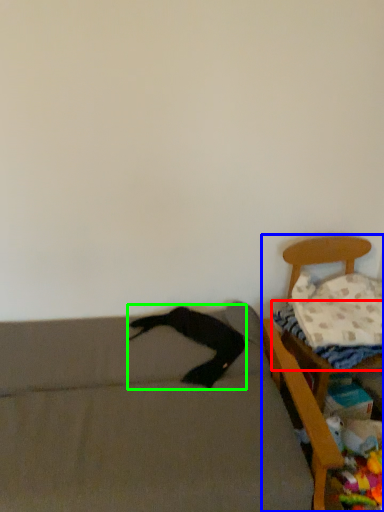
Question: Which object is the closest to the sheet (highlighted by a red box)? Choose among these: furniture (highlighted by a blue box) or clothing (highlighted by a green box).

Choices:
 (A) furniture
 (B) clothing

Answer: (A)